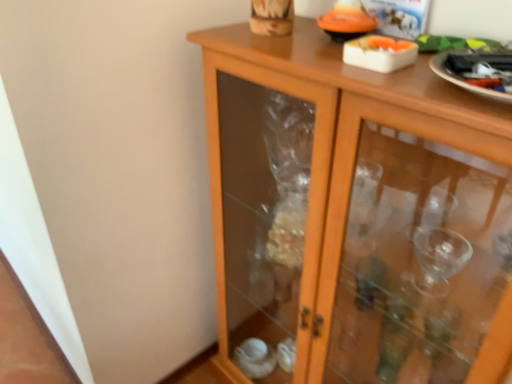
Where is `empty space that is ontop of wooden cabinet at center (from a real-world perspective)`? empty space that is ontop of wooden cabinet at center (from a real-world perspective) is located at coordinates (342, 52).